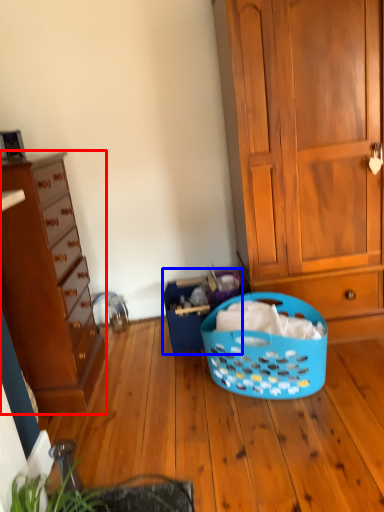
Question: Which object appears farthest to the camera in this image, cabinetry (highlighted by a red box) or shopping basket (highlighted by a blue box)?

Choices:
 (A) cabinetry
 (B) shopping basket

Answer: (B)